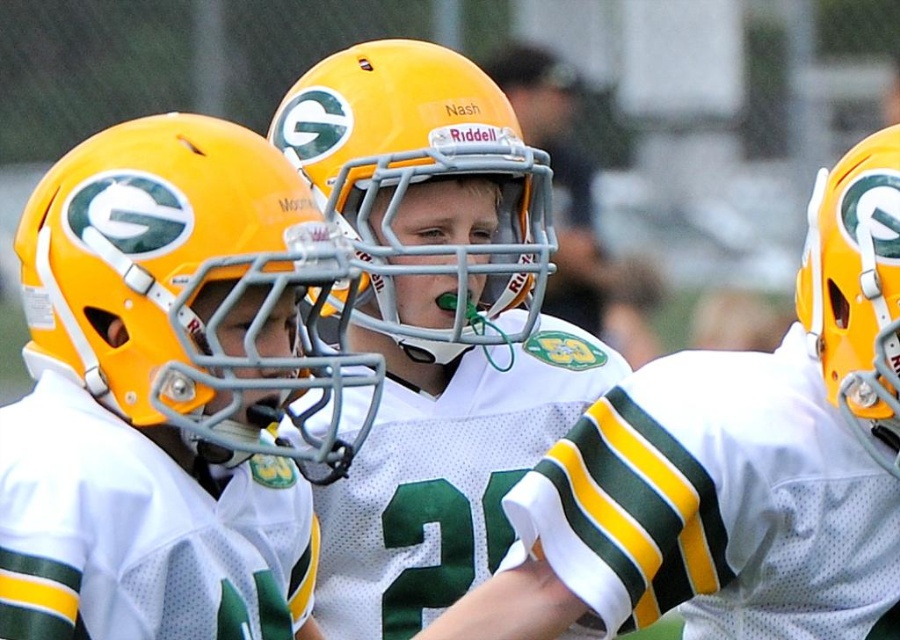
Identify the location of matte plastic helmet at center. [x=731, y=465].

How distant is matte plastic helmet at center from matte yellow football helmet at center?

They are 37.31 inches apart.

Which is in front, point (608, 420) or point (518, 301)?

Point (608, 420)

I want to click on matte plastic helmet at center, so pyautogui.click(x=731, y=465).

At what (x,y) coordinates should I click in order to perform the action: click on matte plastic helmet at center. Please return your answer as a coordinate pair (x, y). This screenshot has width=900, height=640. Looking at the image, I should click on (731, 465).

Is matte plastic helmet at center further to camera compared to matte yellow helmet at center?

That is True.

Who is more forward, (851, 566) or (176, 300)?

Point (176, 300) is more forward.

Identify the location of matte plastic helmet at center. (731, 465).

Between matte yellow helmet at center and matte yellow football helmet at center, which one has less height?

Standing shorter between the two is matte yellow helmet at center.

Can you confirm if matte yellow helmet at center is shorter than matte yellow football helmet at center?

Correct, matte yellow helmet at center is not as tall as matte yellow football helmet at center.

Describe the element at coordinates (190, 288) in the screenshot. I see `matte yellow helmet at center` at that location.

You are a GUI agent. You are given a task and a screenshot of the screen. Output one action in this format:
    pyautogui.click(x=<x>, y=<y>)
    Task: Click on the matte yellow helmet at center
    This screenshot has height=640, width=900.
    Given the screenshot: What is the action you would take?
    pyautogui.click(x=190, y=288)